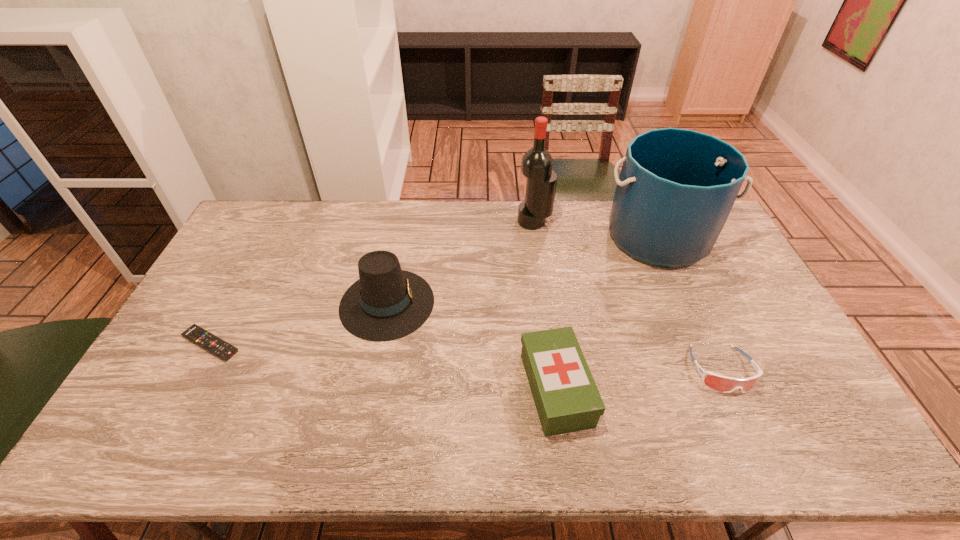
The width and height of the screenshot is (960, 540). What are the coordinates of `free space located 0.240m on the front-facing side of the third tallest object` in the screenshot? It's located at (511, 303).

Locate an element on the screen. The width and height of the screenshot is (960, 540). vacant space located on the left of the first-aid kit is located at coordinates (449, 389).

In order to click on free region located on the front-facing side of the second shortest object in this screenshot , I will do `click(749, 430)`.

The image size is (960, 540). Identify the location of vacant space situated on the right of the shortest object. (309, 344).

This screenshot has width=960, height=540. I want to click on wine bottle present at the far edge, so click(x=537, y=163).

Where is `bucket present at the far edge`? The height and width of the screenshot is (540, 960). bucket present at the far edge is located at coordinates (676, 188).

This screenshot has width=960, height=540. I want to click on object present at the near edge, so click(566, 397).

This screenshot has height=540, width=960. Find the location of `object present at the left edge`. object present at the left edge is located at coordinates (222, 349).

Identify the location of bucket that is at the right edge. This screenshot has height=540, width=960. (676, 188).

Locate an element on the screen. This screenshot has width=960, height=540. goggles that is at the right edge is located at coordinates (724, 384).